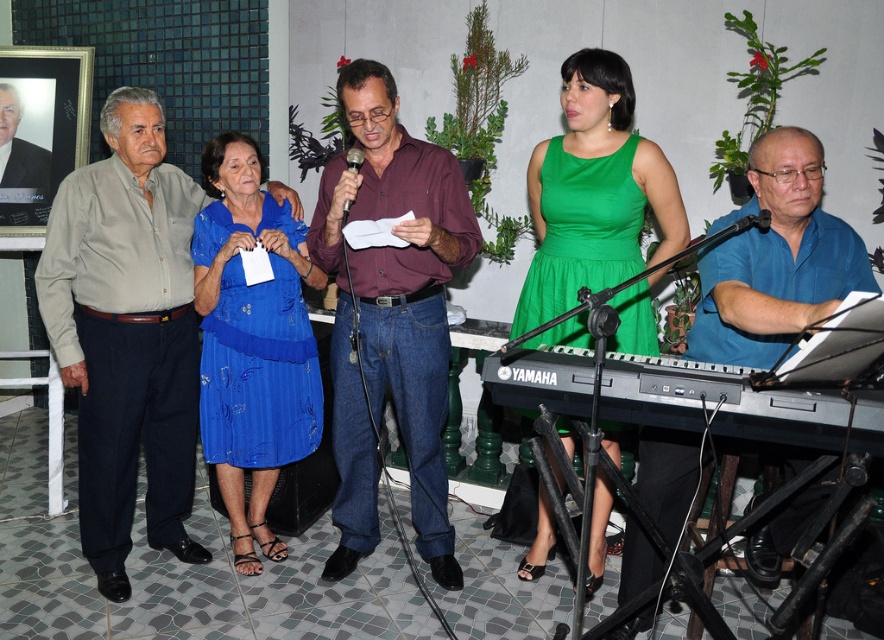
You are organizing a group photo and need to arrange the maroon shirt at center and the blue satin dress at center side by side. Based on their positions in the image, which one should you place on the left to ensure they fit comfortably without overlapping?

The maroon shirt at center is wider than the blue satin dress at center, so placing the maroon shirt at center on the left would allow both to fit comfortably without overlapping since it occupies more horizontal space.

You are organizing a group photo and need to arrange the maroon shirt at center and the blue shirt at right in a row. Which person should stand on the left side to ensure the row looks balanced?

The maroon shirt at center should stand on the left side because its width is larger than the blue shirt at right, so placing the wider one first will create a balanced arrangement.

You are a photographer positioned at the center of the room. You need to capture a group photo that includes both the light brown cotton shirt at left and the blue shirt at right. Given that your camera has a maximum focal length that allows capturing subjects within a 2.0 meters distance from each other, will you be able to include both individuals in a single frame without moving either of them?

The distance between the light brown cotton shirt at left and the blue shirt at right is 1.80 meters, which is within the camera maximum focal length of 2.0 meters. Therefore, you can capture both individuals in a single frame without moving them.